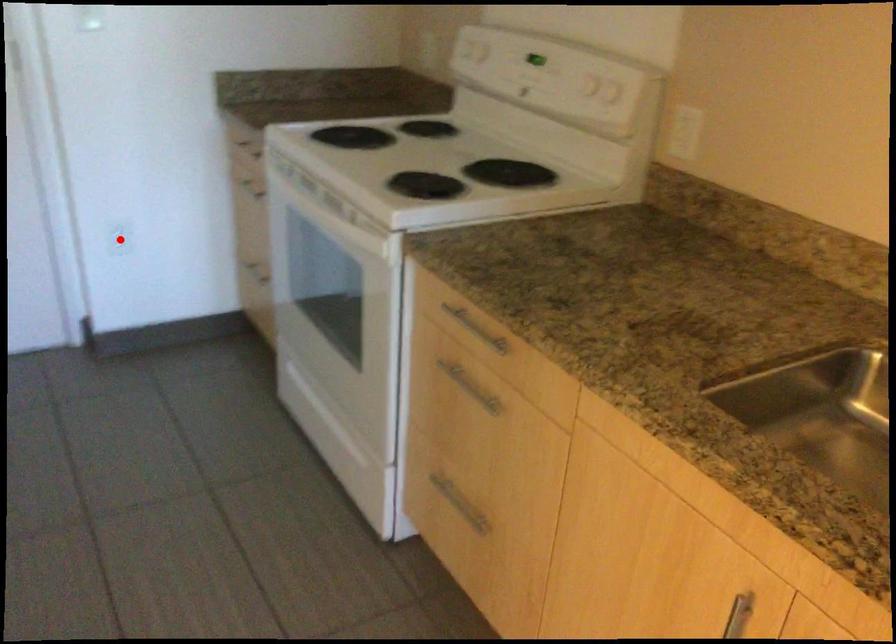
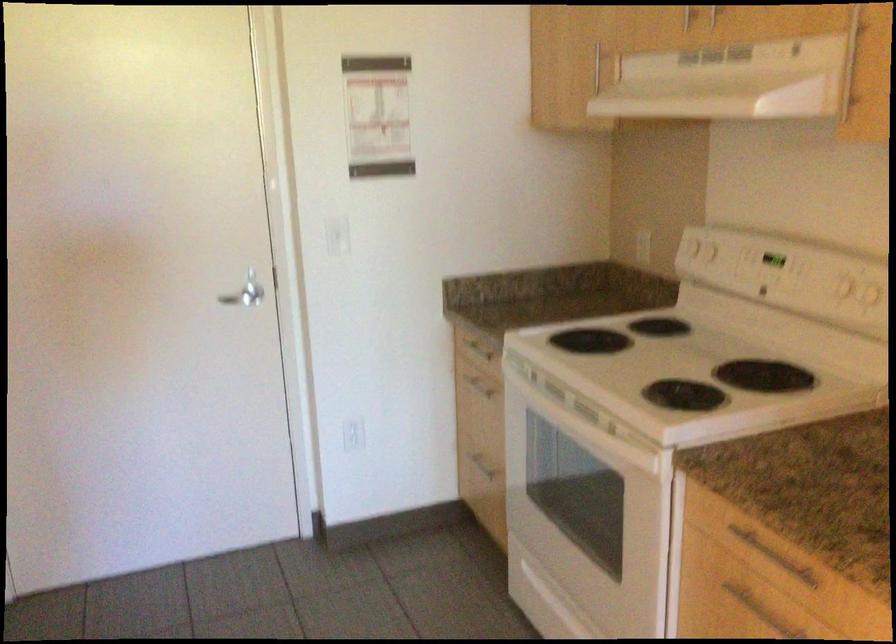
Find the pixel in the second image that matches the highlighted location in the first image.

(352, 433)